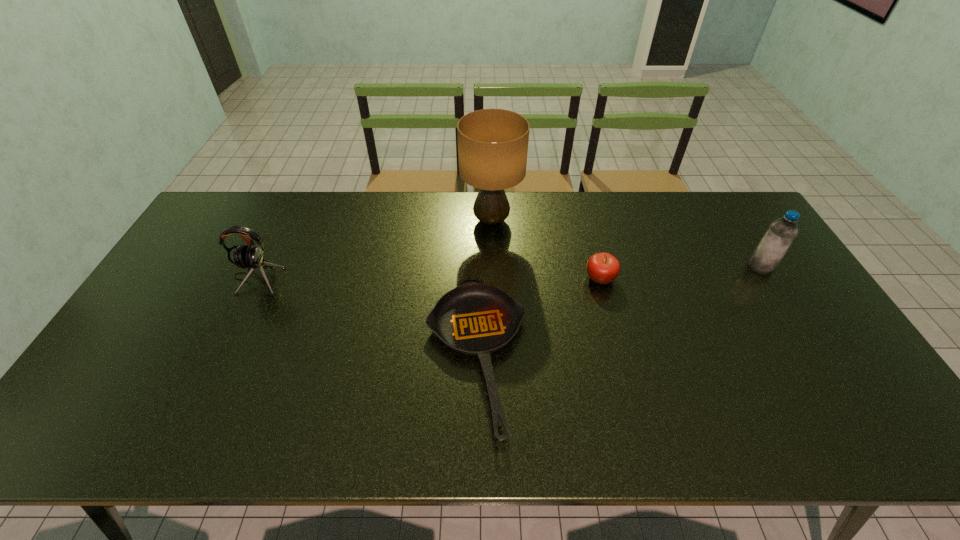
Identify the location of object that can be found as the third closest to the farthest object. This screenshot has width=960, height=540. (251, 257).

Find the location of `free spot that satisfies the following two spatial constraints: 1. on the back side of the earphone; 2. on the right side of the lampshade`. free spot that satisfies the following two spatial constraints: 1. on the back side of the earphone; 2. on the right side of the lampshade is located at coordinates [x=285, y=221].

Locate an element on the screen. This screenshot has height=540, width=960. vacant region that satisfies the following two spatial constraints: 1. on the front side of the leftmost object; 2. on the left side of the shortest object is located at coordinates (220, 355).